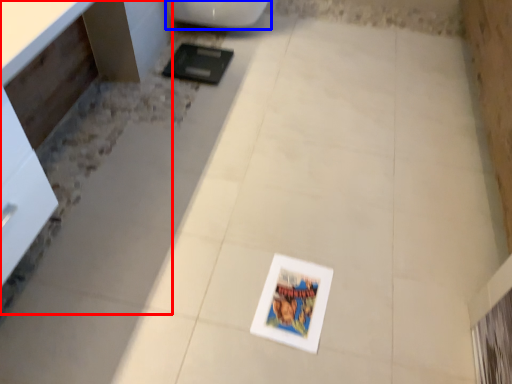
Question: Which of the following is the farthest to the observer, vanity (highlighted by a red box) or toilet (highlighted by a blue box)?

Choices:
 (A) vanity
 (B) toilet

Answer: (B)